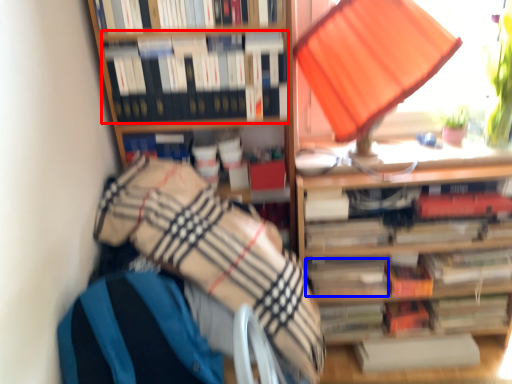
Question: Which point is closer to the camera, book (highlighted by a red box) or paperback book (highlighted by a blue box)?

Choices:
 (A) book
 (B) paperback book

Answer: (A)